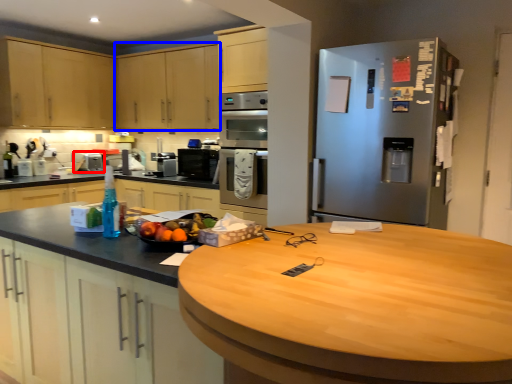
Question: Which object is closer to the camera taking this photo, appliance (highlighted by a red box) or cabinetry (highlighted by a blue box)?

Choices:
 (A) appliance
 (B) cabinetry

Answer: (B)